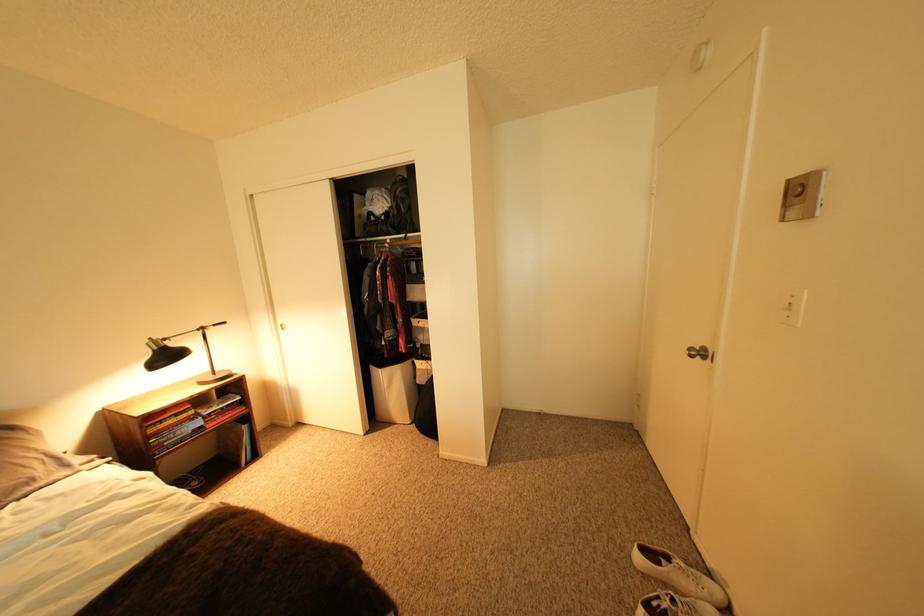
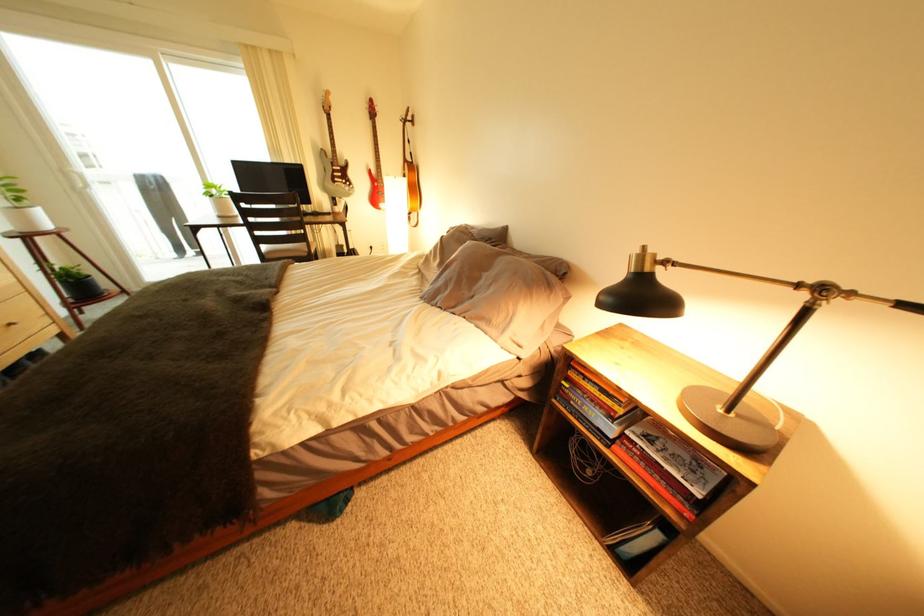
In the second image, find the point that corresponds to (x=215, y=330) in the first image.

(834, 291)